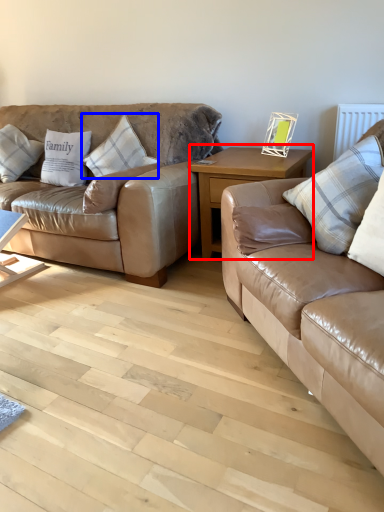
Question: Which point is further to the camera, table (highlighted by a red box) or pillow (highlighted by a blue box)?

Choices:
 (A) table
 (B) pillow

Answer: (B)